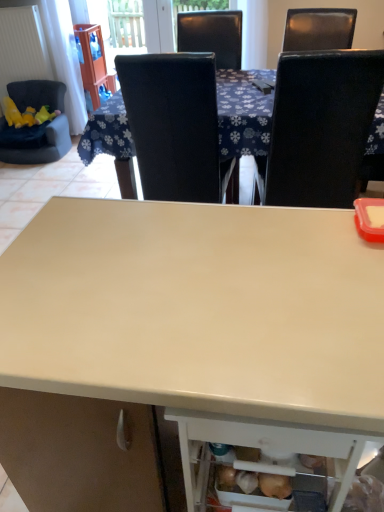
Question: From a real-world perspective, is black leather chair at upper right, the 3th chair positioned from the left, under white glossy table at center?

Choices:
 (A) no
 (B) yes

Answer: (A)

Question: Would you say white glossy table at center is part of black leather chair at upper right, the 1th chair when ordered from right to left,'s contents?

Choices:
 (A) no
 (B) yes

Answer: (A)

Question: Does black leather chair at upper right, the 3th chair positioned from the left, have a larger size compared to white glossy table at center?

Choices:
 (A) yes
 (B) no

Answer: (B)

Question: Is black leather chair at upper right, the 1th chair when ordered from right to left, closer to the viewer compared to white glossy table at center?

Choices:
 (A) yes
 (B) no

Answer: (A)

Question: Would you say black leather chair at upper right, the 3th chair positioned from the left, is outside white glossy table at center?

Choices:
 (A) yes
 (B) no

Answer: (B)

Question: Is velvet dark blue chair at left, arranged as the 3th chair when viewed from the right, spatially inside white glossy table at center, or outside of it?

Choices:
 (A) inside
 (B) outside

Answer: (B)

Question: Based on their positions, is velvet dark blue chair at left, positioned as the first chair in left-to-right order, located to the left or right of white glossy table at center?

Choices:
 (A) left
 (B) right

Answer: (A)

Question: Considering the positions of point (69, 137) and point (256, 152), is point (69, 137) closer or farther from the camera than point (256, 152)?

Choices:
 (A) farther
 (B) closer

Answer: (A)

Question: Considering the positions of velvet dark blue chair at left, positioned as the first chair in left-to-right order, and white glossy table at center in the image, is velvet dark blue chair at left, positioned as the first chair in left-to-right order, taller or shorter than white glossy table at center?

Choices:
 (A) tall
 (B) short

Answer: (B)

Question: Which is correct: velvet dark blue chair at left, arranged as the 3th chair when viewed from the right, is inside black leather chair at upper center, which ranks as the 2th chair in right-to-left order, or outside of it?

Choices:
 (A) outside
 (B) inside

Answer: (A)

Question: Is point (1, 148) positioned closer to the camera than point (198, 90)?

Choices:
 (A) farther
 (B) closer

Answer: (A)

Question: In terms of size, does velvet dark blue chair at left, arranged as the 3th chair when viewed from the right, appear bigger or smaller than black leather chair at upper center, which ranks as the 2th chair in right-to-left order?

Choices:
 (A) big
 (B) small

Answer: (B)

Question: Is velvet dark blue chair at left, positioned as the first chair in left-to-right order, taller or shorter than black leather chair at upper center, the 2th chair positioned from the left?

Choices:
 (A) tall
 (B) short

Answer: (B)

Question: In terms of width, does black leather chair at upper center, the 2th chair positioned from the left, look wider or thinner when compared to matte white desk at center?

Choices:
 (A) thin
 (B) wide

Answer: (A)

Question: Is point (132, 111) positioned closer to the camera than point (41, 245)?

Choices:
 (A) closer
 (B) farther

Answer: (B)